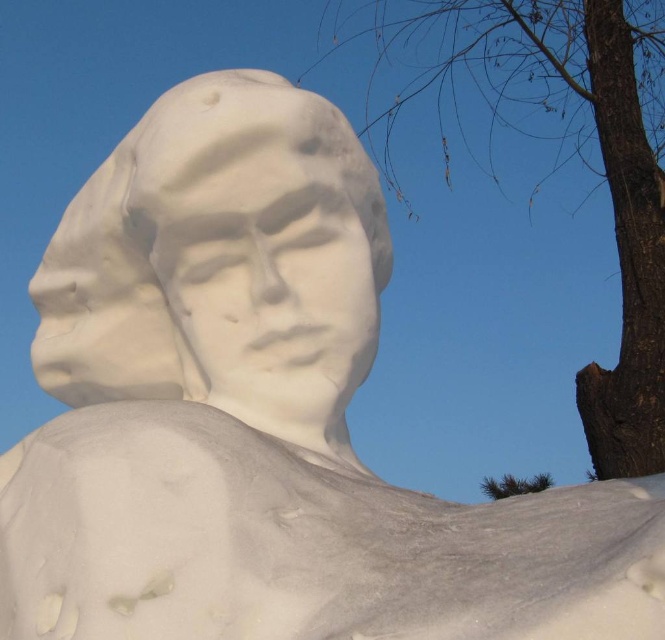
Question: Can you confirm if white snow sculpture at center is positioned to the left of brown rough bark at upper right?

Choices:
 (A) yes
 (B) no

Answer: (A)

Question: Is white snow sculpture at center smaller than brown rough bark at upper right?

Choices:
 (A) yes
 (B) no

Answer: (A)

Question: Observing the image, what is the correct spatial positioning of white snow sculpture at center in reference to brown rough bark at upper right?

Choices:
 (A) right
 (B) left

Answer: (B)

Question: Which object appears closest to the camera in this image?

Choices:
 (A) white snow sculpture at center
 (B) brown rough bark at upper right

Answer: (A)